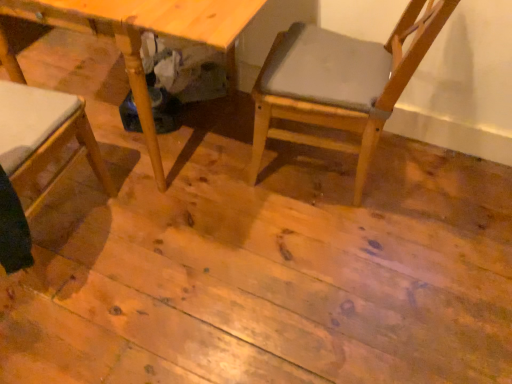
What are the coordinates of `free space underneath natural wood table at center (from a real-world perspective)` in the screenshot? It's located at (163, 144).